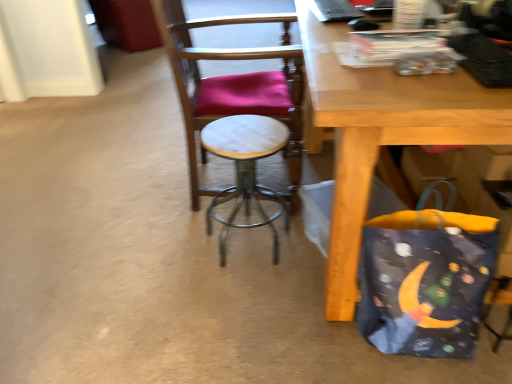
Find the location of a particular element. The height and width of the screenshot is (384, 512). vacant area to the left of white marble stool at center is located at coordinates (164, 247).